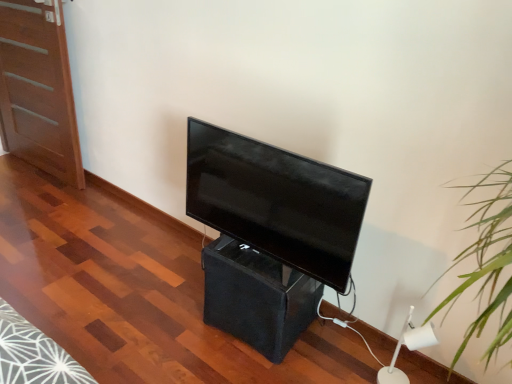
You are a GUI agent. You are given a task and a screenshot of the screen. Output one action in this format:
    pyautogui.click(x=<x>, y=<y>)
    Task: Click on the free space in front of matte wood door at left
    This screenshot has height=384, width=512.
    Given the screenshot: What is the action you would take?
    pyautogui.click(x=34, y=197)